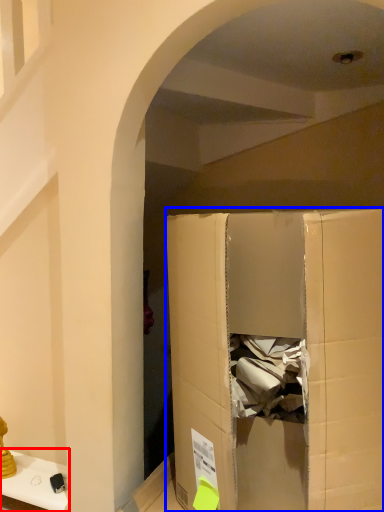
Question: Which of the following is the farthest to the observer, furniture (highlighted by a red box) or cardboard box (highlighted by a blue box)?

Choices:
 (A) furniture
 (B) cardboard box

Answer: (A)